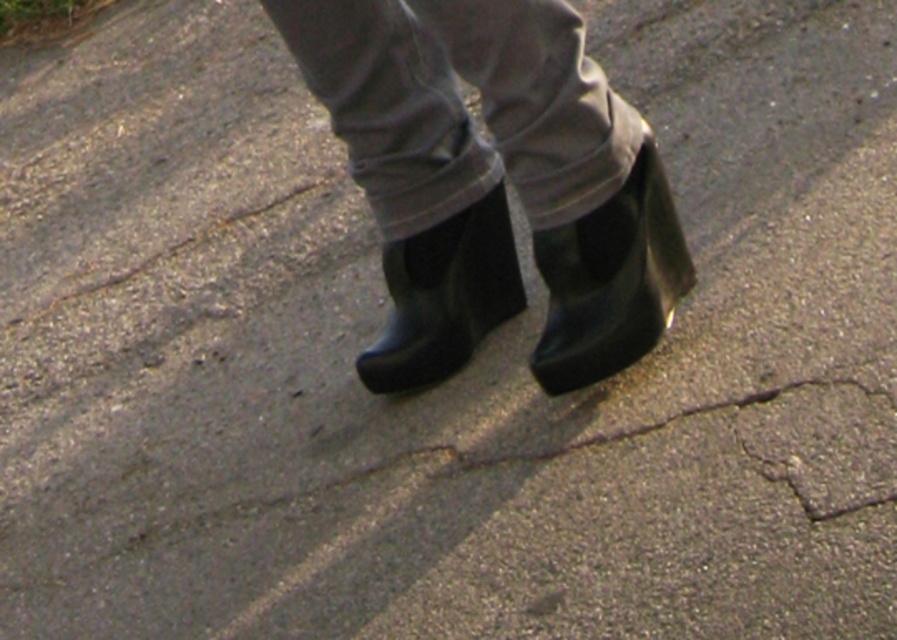
Question: From the image, what is the correct spatial relationship of rubber boots at center in relation to black rubber boot at center?

Choices:
 (A) above
 (B) below

Answer: (A)

Question: Does rubber boots at center have a lesser width compared to black rubber boot at center?

Choices:
 (A) no
 (B) yes

Answer: (A)

Question: Which of the following is the farthest from the observer?

Choices:
 (A) black rubber boot at center
 (B) rubber boot at center

Answer: (A)

Question: Estimate the real-world distances between objects in this image. Which object is closer to the rubber boots at center?

Choices:
 (A) rubber boot at center
 (B) black rubber boot at center

Answer: (A)

Question: Which object is the farthest from the rubber boot at center?

Choices:
 (A) black rubber boot at center
 (B) rubber boots at center

Answer: (A)

Question: Is rubber boots at center to the right of black rubber boot at center from the viewer's perspective?

Choices:
 (A) no
 (B) yes

Answer: (B)